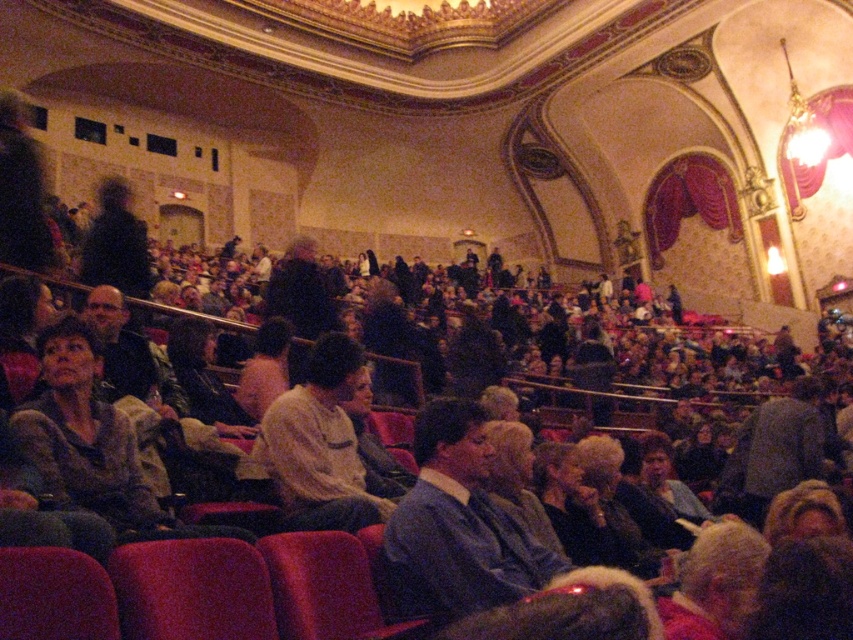
Can you confirm if blue sweater at center is smaller than light beige shirt at center?

No.

Does blue sweater at center appear on the left side of light beige shirt at center?

Incorrect, blue sweater at center is not on the left side of light beige shirt at center.

Where is `blue sweater at center`? blue sweater at center is located at coordinates pos(457,525).

The image size is (853, 640). Find the location of `blue sweater at center`. blue sweater at center is located at coordinates (457, 525).